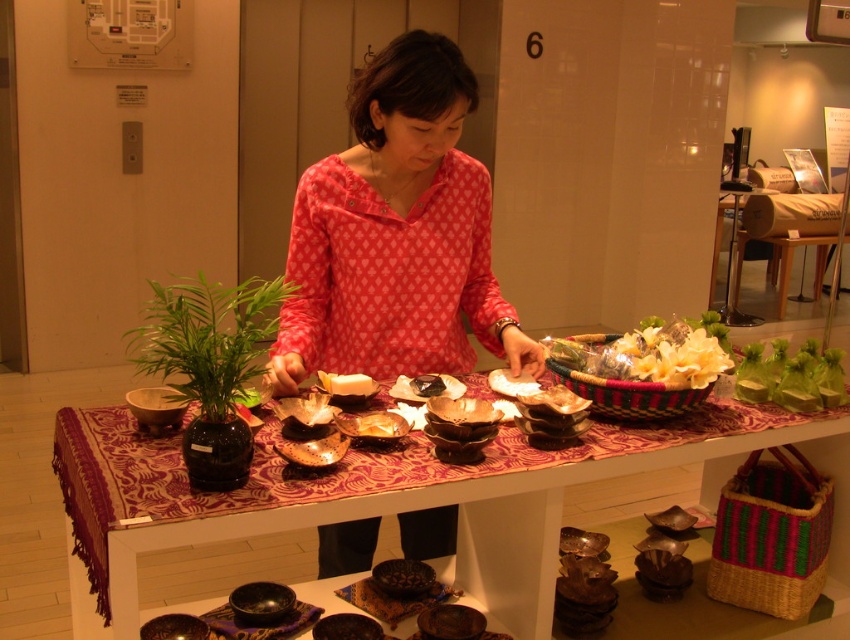
You are a customer in the store and you want to buy the green paper wrapped food at center. The saleswoman is wearing the pink printed blouse at center. Which object is on the right side when you look at the display?

The green paper wrapped food at center is on the right side of the pink printed blouse at center.